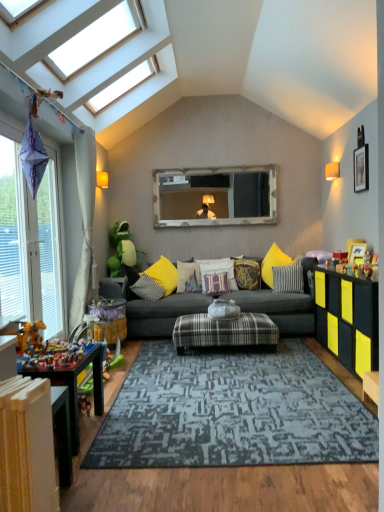
You are a GUI agent. You are given a task and a screenshot of the screen. Output one action in this format:
    pyautogui.click(x=<x>, y=<y>)
    Task: Click on the free space underneath multicolored plastic toys at lower left, which is the first toy from bottom to top (from a real-world perspective)
    The image size is (384, 512).
    Given the screenshot: What is the action you would take?
    pyautogui.click(x=57, y=356)